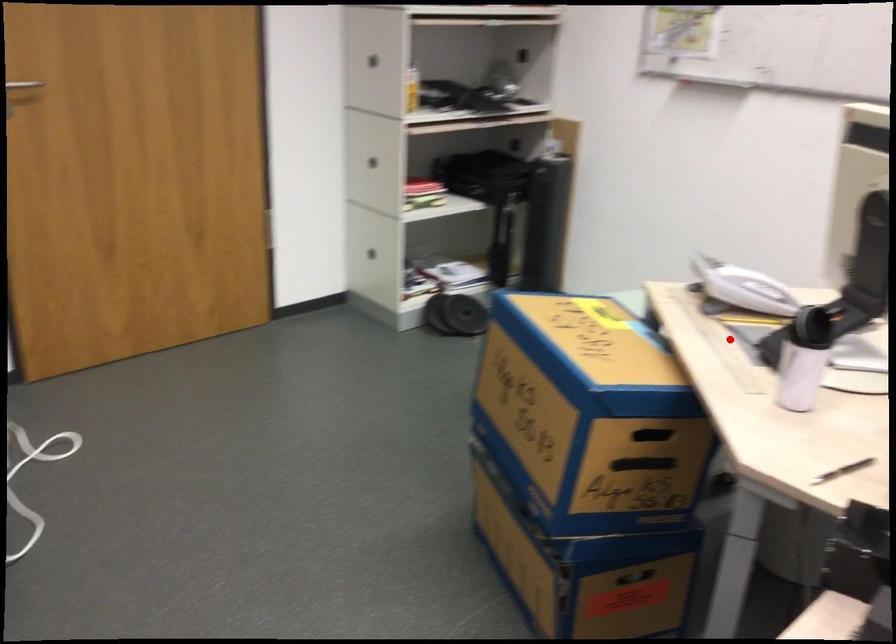
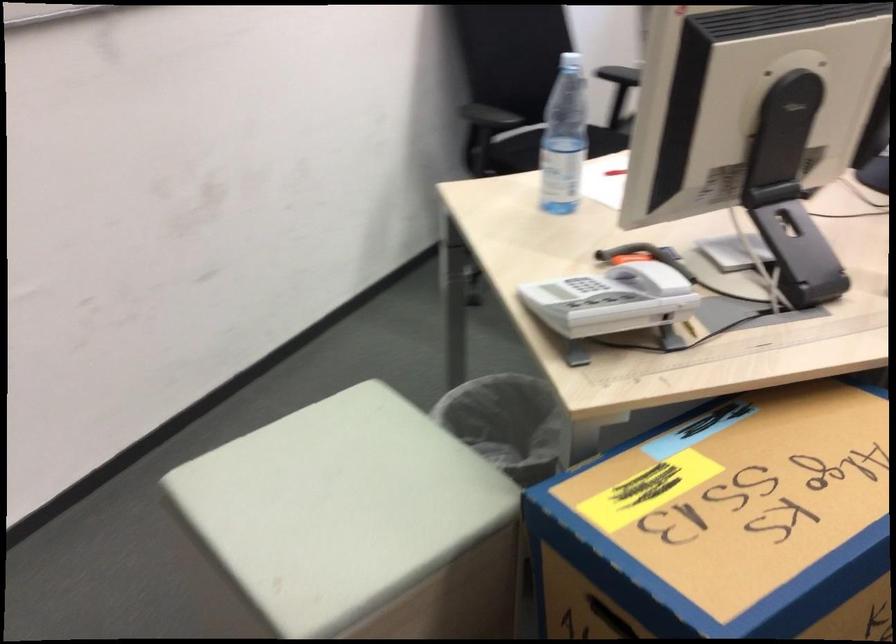
The point at the highlighted location is marked in the first image. Where is the corresponding point in the second image?

(746, 334)